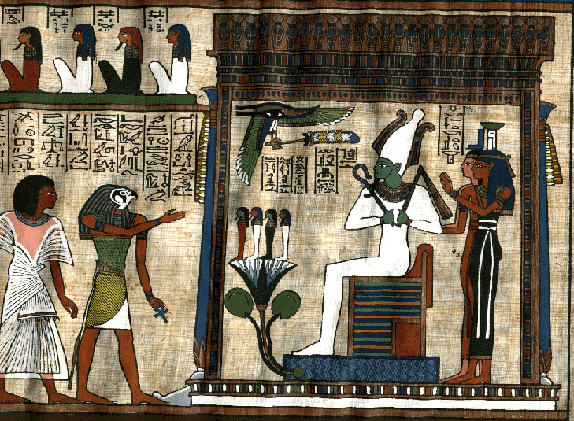
At what (x,y) coordinates should I click in order to perform the action: click on floor. Please return your answer as a coordinate pair (x, y). Looking at the image, I should click on (131, 408).